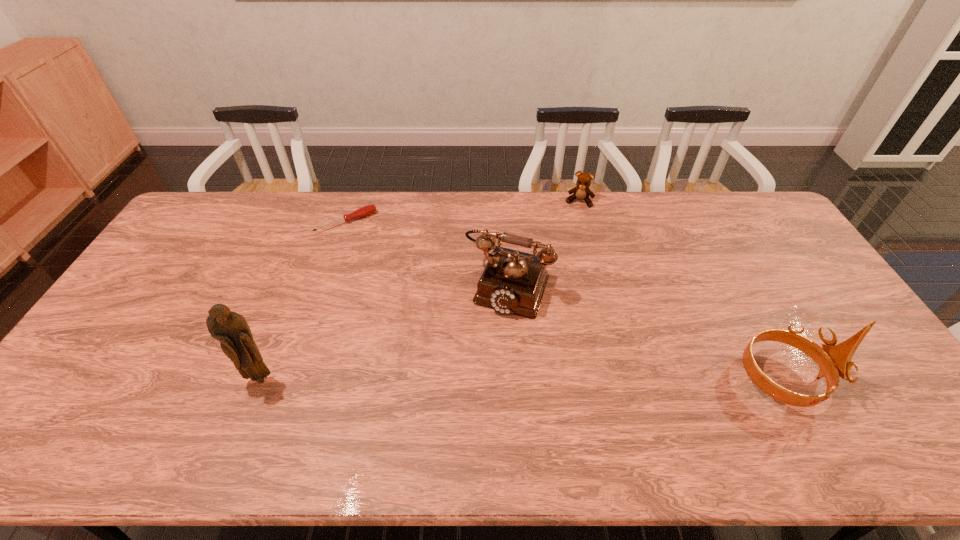
Locate an element on the screen. figurine is located at coordinates (230, 328).

Identify the location of tiara. (833, 360).

This screenshot has height=540, width=960. Identify the location of screwdriver. (366, 210).

You are a GUI agent. You are given a task and a screenshot of the screen. Output one action in this format:
    pyautogui.click(x=<x>, y=<y>)
    Task: Click on the shortest object
    This screenshot has height=540, width=960.
    Given the screenshot: What is the action you would take?
    pyautogui.click(x=366, y=210)

Where is `telephone`? The height and width of the screenshot is (540, 960). telephone is located at coordinates (513, 282).

Where is `the third object from right to left`? The width and height of the screenshot is (960, 540). the third object from right to left is located at coordinates (513, 282).

I want to click on the farthest object, so click(581, 192).

You are a GUI agent. You are given a task and a screenshot of the screen. Output one action in this format:
    pyautogui.click(x=<x>, y=<y>)
    Task: Click on the teddy bear
    The height and width of the screenshot is (540, 960).
    Given the screenshot: What is the action you would take?
    pyautogui.click(x=581, y=192)

Where is `vacant space located 0.060m on the front-facing side of the figurine`? vacant space located 0.060m on the front-facing side of the figurine is located at coordinates (249, 408).

The height and width of the screenshot is (540, 960). Identify the location of free space located on the front-facing side of the tiara. (880, 379).